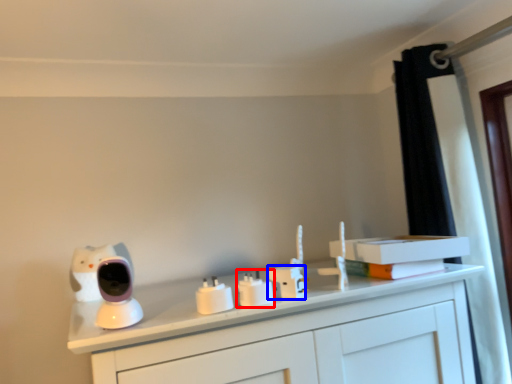
Question: Which object appears closest to the camera in this image, electric outlet (highlighted by a red box) or electric outlet (highlighted by a blue box)?

Choices:
 (A) electric outlet
 (B) electric outlet

Answer: (A)